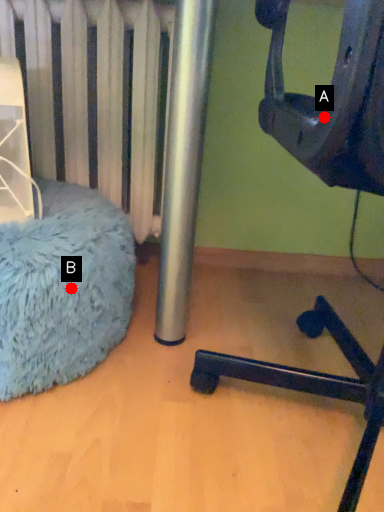
Question: Two points are circled on the image, labeled by A and B beside each circle. Which point is closer to the camera?

Choices:
 (A) A is closer
 (B) B is closer

Answer: (A)